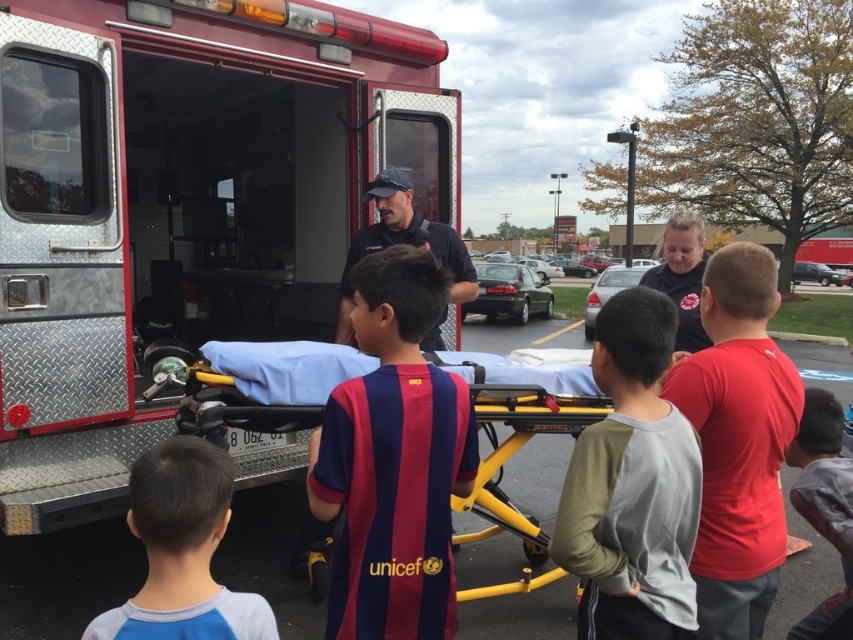
You are a photographer trying to capture a photo of the metallic silver fire truck at left and the dark gray cotton shirt at lower right. Since you want both subjects to appear equally large in the photo, which subject should you move closer to and which should you move further away?

The metallic silver fire truck at left is narrower than the dark gray cotton shirt at lower right. To make both appear equally large in the photo, move the camera closer to the metallic silver fire truck at left and further away from the dark gray cotton shirt at lower right.

You are a photographer standing at the center of the scene. You want to take a photo that includes both the metallic silver fire truck at left and the dark gray cotton shirt at lower right. Given that your camera has a maximum focal length that allows capturing objects up to 8 meters apart, will you be able to frame both subjects in a single shot?

The metallic silver fire truck at left and dark gray cotton shirt at lower right are 7.64 meters apart from each other. Since the distance between them is within the camera maximum focal length of 8 meters, you can frame both subjects in a single shot.